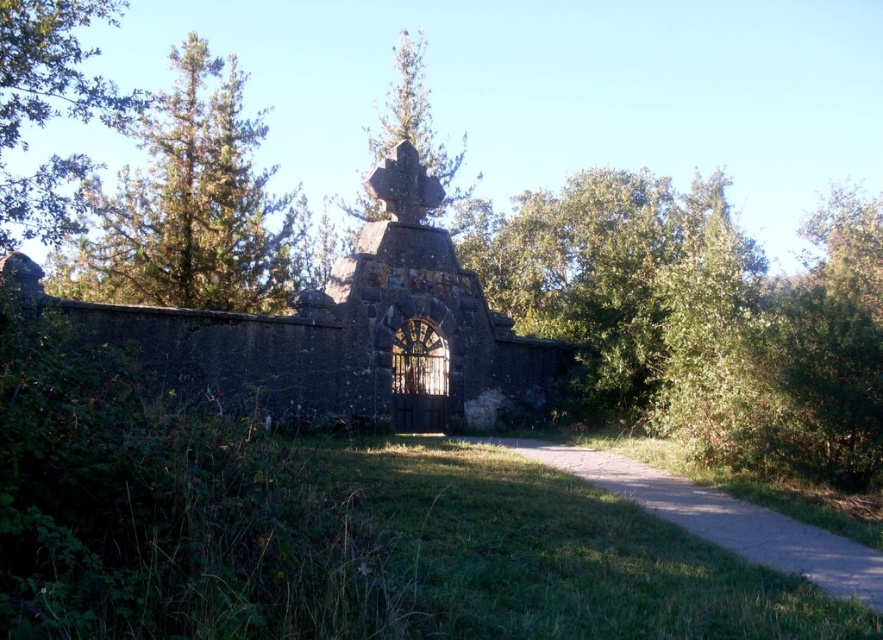
You are standing at the entrance of the cemetery and want to locate the dark stone church at center. According to the coordinates provided, where exactly should you look to find it?

The dark stone church at center is located at point coordinates of (351,332).

You are standing at the entrance of the cemetery and see two points marked on the ground. The first point is at coordinate point (97, 276) and the second is at coordinate point (14, 205). If you want to walk towards the point that is further away from you, which coordinate should you head towards?

Point (97, 276) is behind point (14, 205), so you should head towards point (97, 276) to reach the one further away.

You are a gardener tasked with trimming the green leafy tree at upper right and the green leafy tree at upper left. Based on their sizes, which tree will require more branches to be cut?

The green leafy tree at upper left will require more branches to be cut because it is thicker than the green leafy tree at upper right.